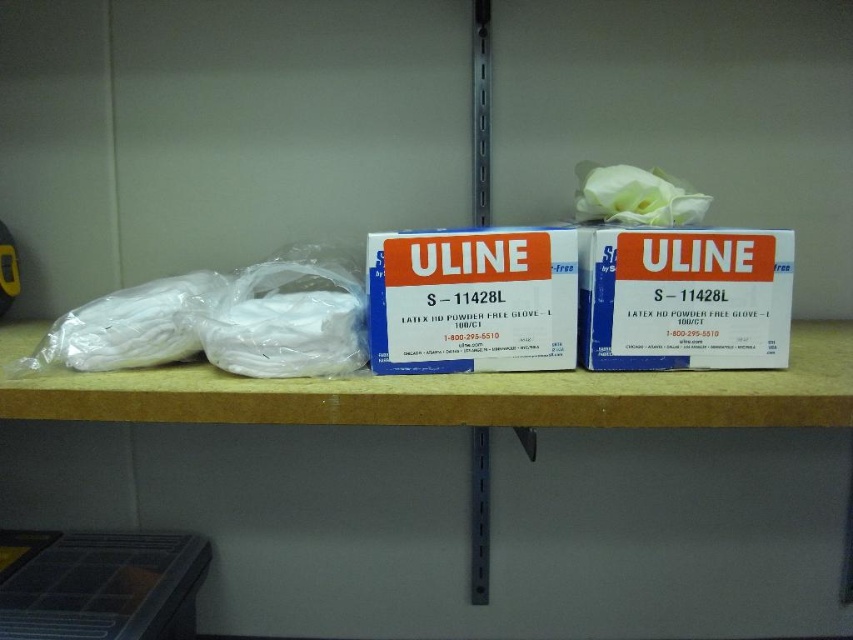
You are organizing a medical supply closet and need to place the white plastic gloves at center and the white matte box at center on a shelf. Given their sizes, which item should you place first to ensure stability?

The white plastic gloves at center is bigger than the white matte box at center, so you should place the white plastic gloves at center first to provide a stable base for the smaller box.

You are organizing items on a shelf and need to place a new item that is 12 inches wide. The shelf has a blue cardboard box at center and a translucent plastic bag at left. Which item should you move to accommodate the new item?

The blue cardboard box at center has a larger width than the translucent plastic bag at left. To make space for the 12 inch item, move the translucent plastic bag at left since it is narrower and easier to relocate.

You are organizing the shelf and need to stack items vertically. Given the white plastic gloves at center and the white matte box at center, which item can be placed on top without exceeding the shelf height limit?

The white plastic gloves at center has a lesser height compared to the white matte box at center, so placing the white plastic gloves at center on top of the white matte box at center would not exceed the shelf height limit.